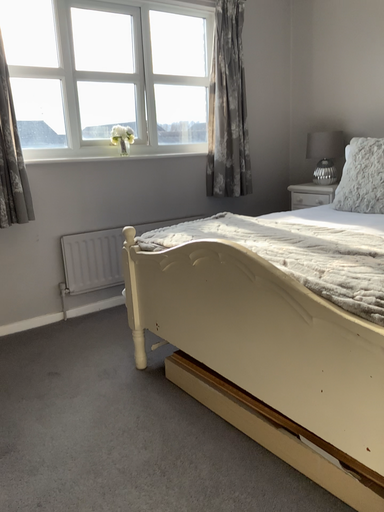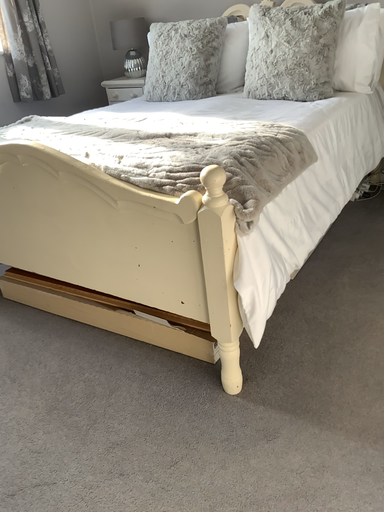
Question: How did the camera likely rotate when shooting the video?

Choices:
 (A) rotated upward
 (B) rotated downward

Answer: (B)